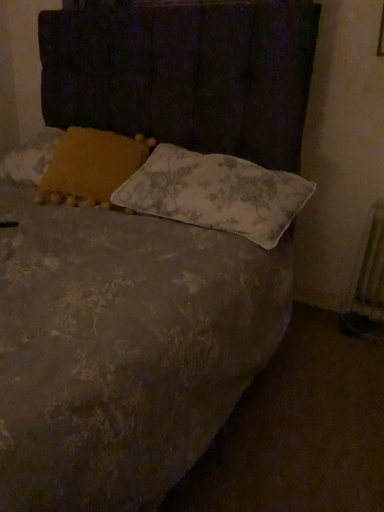
Question: In terms of height, does yellow fabric pillow at upper left, the 2th pillow when ordered from right to left, look taller or shorter compared to metallic silver radiator at right?

Choices:
 (A) short
 (B) tall

Answer: (A)

Question: From a real-world perspective, is yellow fabric pillow at upper left, the 1th pillow positioned from the left, above or below metallic silver radiator at right?

Choices:
 (A) above
 (B) below

Answer: (A)

Question: Based on their relative distances, which object is farther from the yellow fabric pillow at upper left, the 1th pillow positioned from the left?

Choices:
 (A) metallic silver radiator at right
 (B) floral-patterned fabric pillow at center, which appears as the first pillow when viewed from the right

Answer: (A)

Question: Considering the real-world distances, which object is farthest from the metallic silver radiator at right?

Choices:
 (A) floral-patterned fabric pillow at center, which appears as the first pillow when viewed from the right
 (B) yellow fabric pillow at upper left, the 2th pillow when ordered from right to left

Answer: (B)